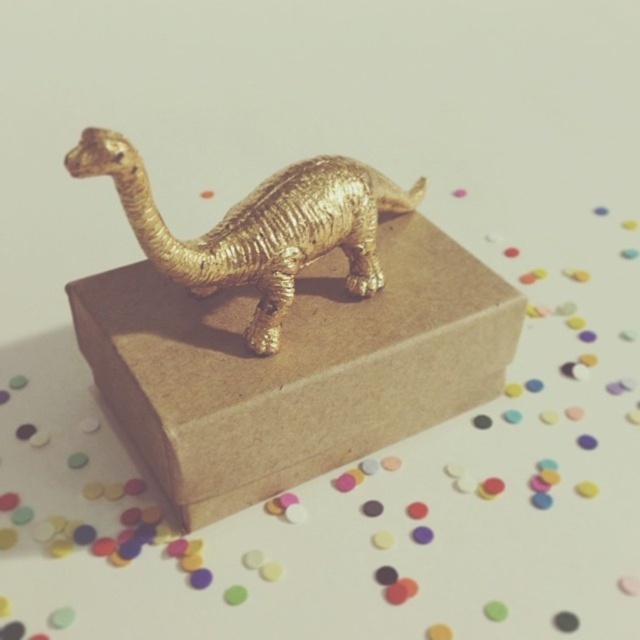
Question: Can you confirm if brown cardboard box at center is positioned below gold textured dinosaur at center?

Choices:
 (A) yes
 (B) no

Answer: (A)

Question: Does brown cardboard box at center appear on the left side of gold textured dinosaur at center?

Choices:
 (A) no
 (B) yes

Answer: (A)

Question: Can you confirm if brown cardboard box at center is smaller than gold textured dinosaur at center?

Choices:
 (A) no
 (B) yes

Answer: (A)

Question: Among these objects, which one is nearest to the camera?

Choices:
 (A) gold textured dinosaur at center
 (B) brown cardboard box at center

Answer: (A)

Question: Among these points, which one is farthest from the camera?

Choices:
 (A) (292, 394)
 (B) (346, 168)

Answer: (B)